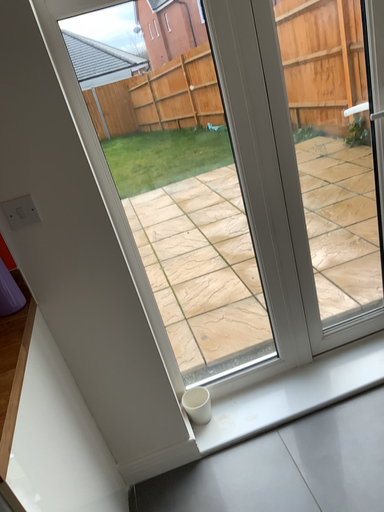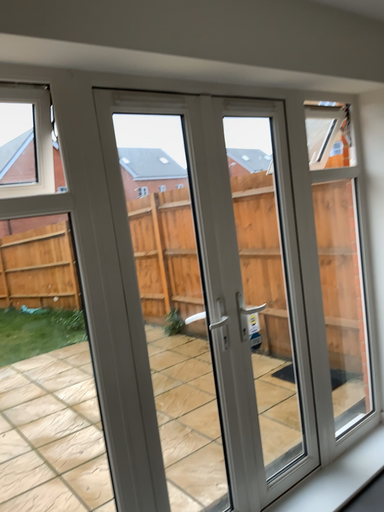
Question: Which way did the camera rotate in the video?

Choices:
 (A) rotated right
 (B) rotated left

Answer: (A)